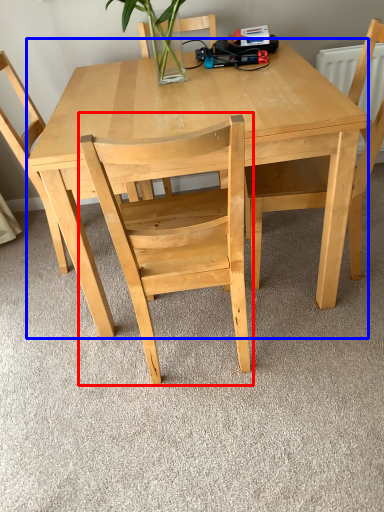
Question: Which object is closer to the camera taking this photo, chair (highlighted by a red box) or table (highlighted by a blue box)?

Choices:
 (A) chair
 (B) table

Answer: (A)